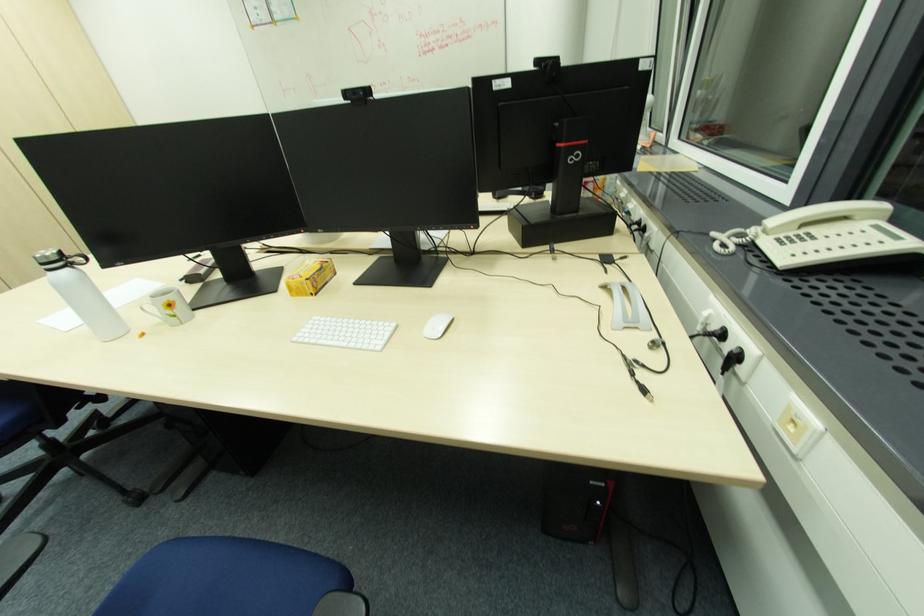
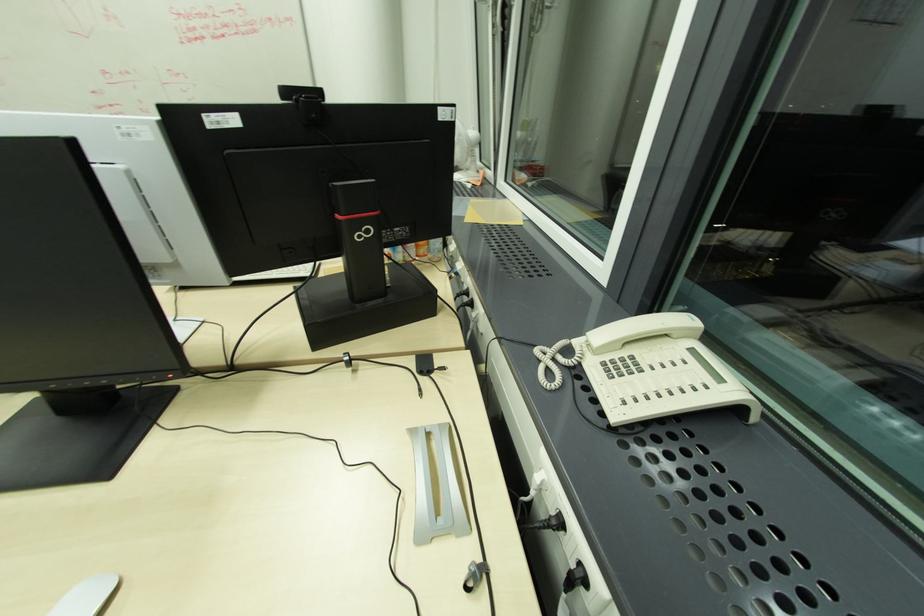
Which direction would the cameraman need to move to produce the second image?

The cameraman walked toward right, forward.